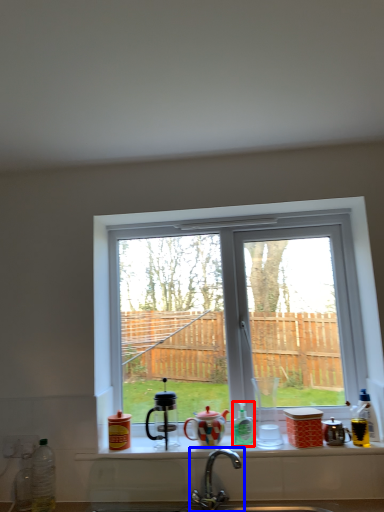
Question: Which point is closer to the camera, bottle (highlighted by a red box) or tap (highlighted by a blue box)?

Choices:
 (A) bottle
 (B) tap

Answer: (B)